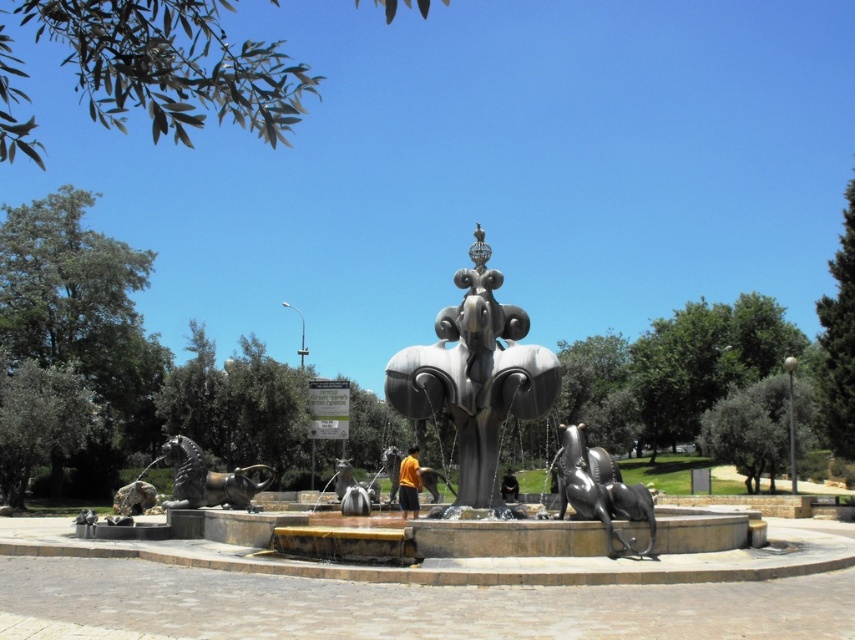
Question: Which point is farther to the camera?

Choices:
 (A) polished silver fountain at center
 (B) polished silver sculpture at center

Answer: (B)

Question: Observing the image, what is the correct spatial positioning of polished silver sculpture at center in reference to black polished horse at lower right?

Choices:
 (A) below
 (B) above

Answer: (B)

Question: Is polished silver fountain at center positioned in front of bronze horse at lower left?

Choices:
 (A) no
 (B) yes

Answer: (B)

Question: Is polished silver fountain at center wider than black polished horse at lower right?

Choices:
 (A) yes
 (B) no

Answer: (A)

Question: Estimate the real-world distances between objects in this image. Which object is farther from the polished silver fountain at center?

Choices:
 (A) black polished horse at lower right
 (B) polished silver sculpture at center
 (C) bronze horse at lower left

Answer: (C)

Question: Which point is closer to the camera?

Choices:
 (A) (612, 460)
 (B) (214, 502)

Answer: (A)